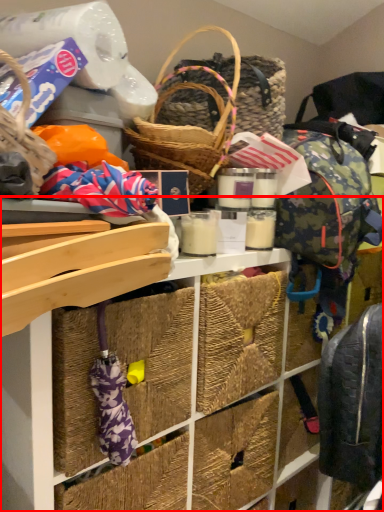
Question: Observing the image, what is the correct spatial positioning of shelf (annotated by the red box) in reference to backpack?

Choices:
 (A) right
 (B) left

Answer: (B)